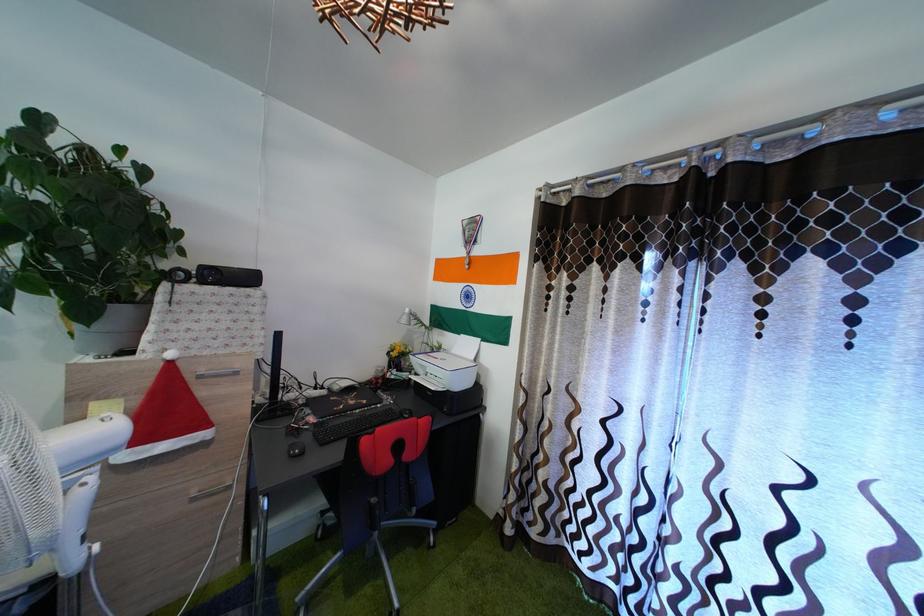
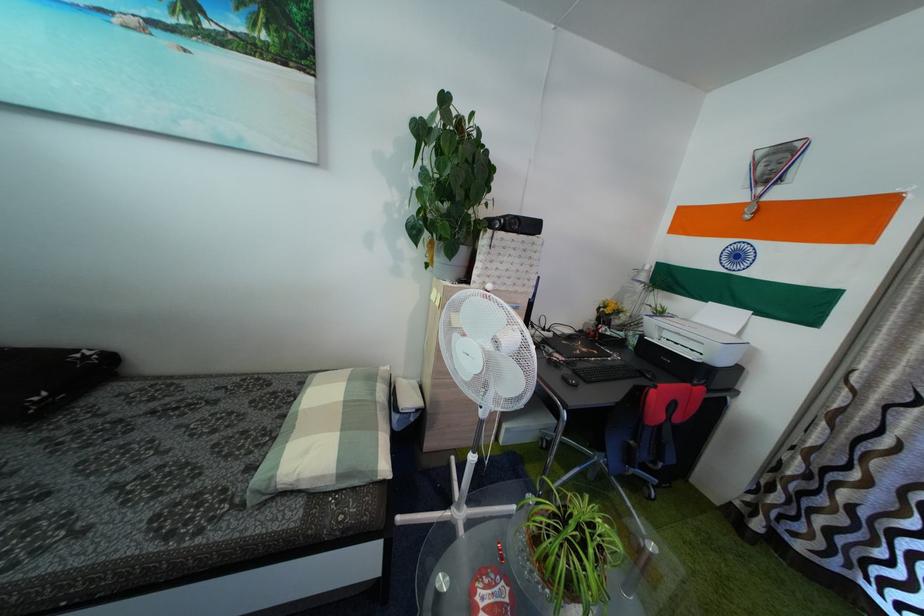
Locate, in the second image, the point that corresponds to pixel 462 359 in the first image.

(703, 328)